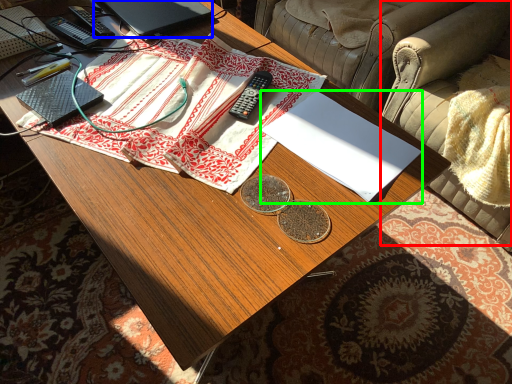
Question: Which object is positioned closest to armchair (highlighted by a red box)? Select from laptop (highlighted by a blue box) and notebook (highlighted by a green box).

Choices:
 (A) laptop
 (B) notebook

Answer: (B)